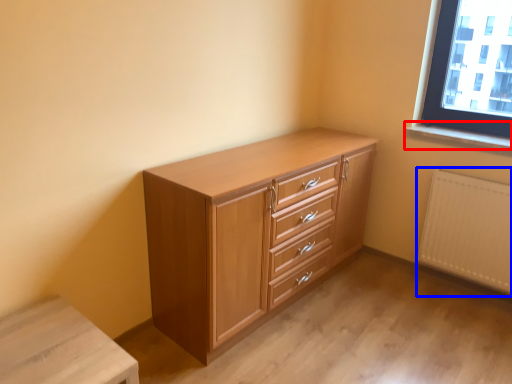
Question: Which object is further to the camera taking this photo, window sill (highlighted by a red box) or radiator (highlighted by a blue box)?

Choices:
 (A) window sill
 (B) radiator

Answer: (A)